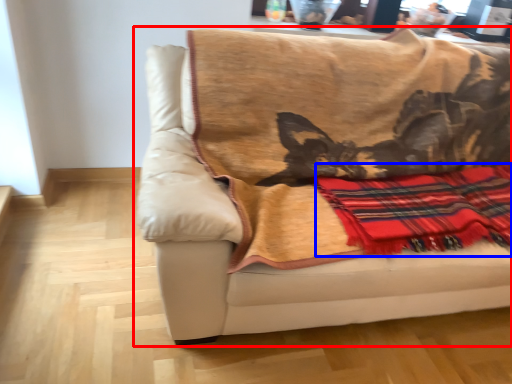
Question: Which point is closer to the camera, studio couch (highlighted by a red box) or plaid (highlighted by a blue box)?

Choices:
 (A) studio couch
 (B) plaid

Answer: (A)